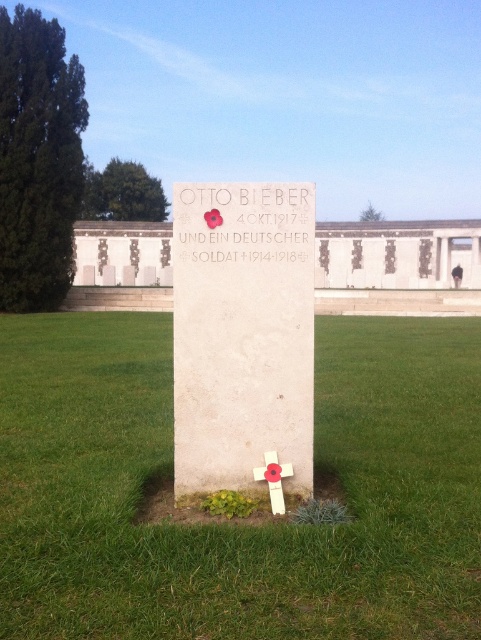
Question: Which is nearer to the red poppy at center?

Choices:
 (A) green grass at center
 (B) white marble cross at center

Answer: (B)

Question: Estimate the real-world distances between objects in this image. Which object is closer to the white marble cross at center?

Choices:
 (A) green grass at center
 (B) red poppy at center

Answer: (B)

Question: Can you confirm if green grass at center is positioned above white marble cross at center?

Choices:
 (A) no
 (B) yes

Answer: (A)

Question: Is green grass at center above white marble cross at center?

Choices:
 (A) no
 (B) yes

Answer: (A)

Question: Which object is farther from the camera taking this photo?

Choices:
 (A) red poppy at center
 (B) white marble cross at center

Answer: (A)

Question: Does white marble cross at center lie behind red poppy at center?

Choices:
 (A) yes
 (B) no

Answer: (B)